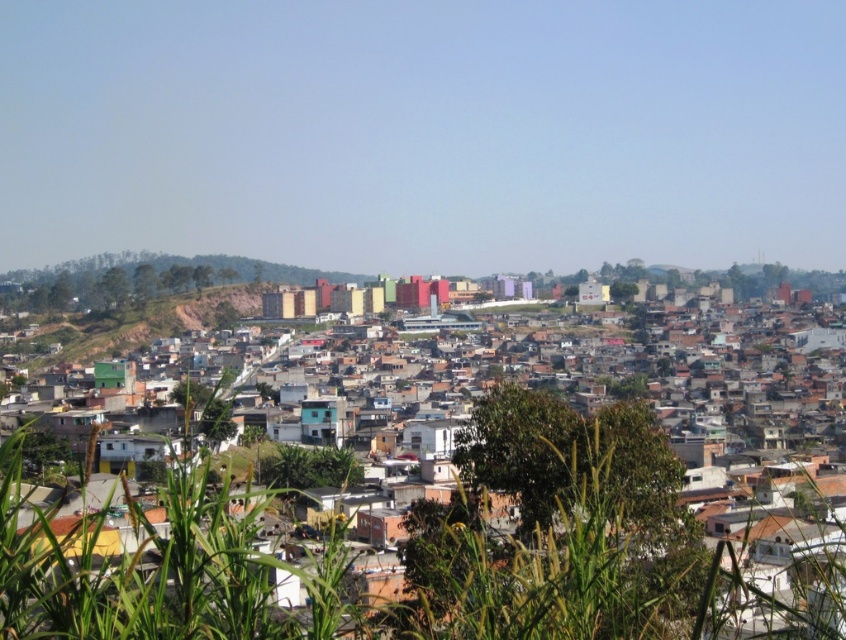
Can you confirm if multicolored buildings at center is positioned above brown dirt at left?

No, multicolored buildings at center is not above brown dirt at left.

Which is in front, point (781, 397) or point (69, 353)?

Point (781, 397) is more forward.

Find the location of a particular element. Image resolution: width=846 pixels, height=640 pixels. multicolored buildings at center is located at coordinates (613, 483).

Find the location of a particular element. The image size is (846, 640). multicolored buildings at center is located at coordinates (613, 483).